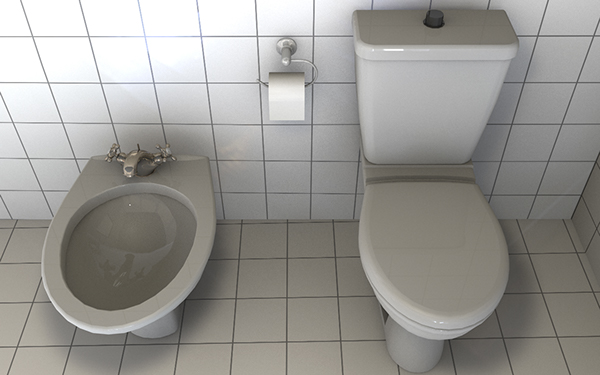
Locate an element on the screen. The width and height of the screenshot is (600, 375). toilet paper holder is located at coordinates (286, 54).